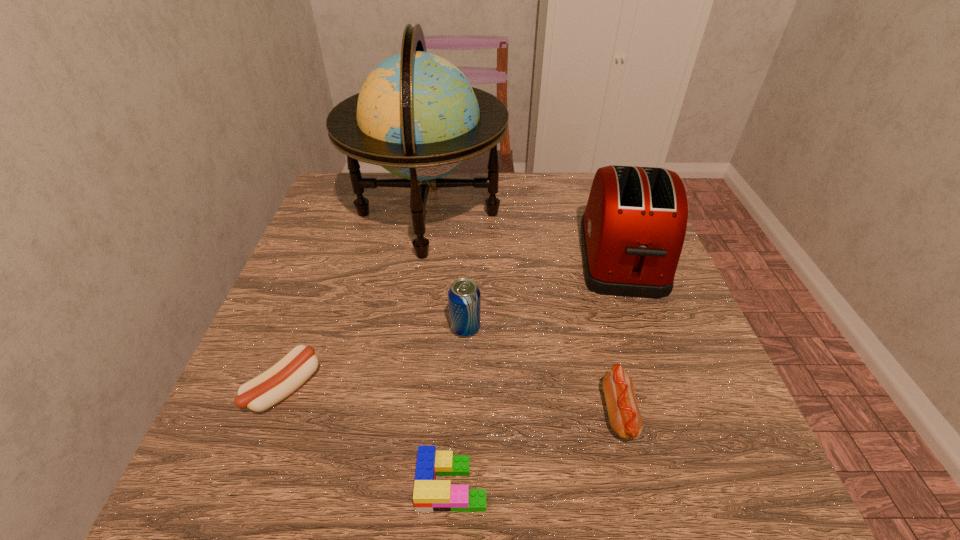
Identify the location of vacant space at the left edge. (349, 245).

The width and height of the screenshot is (960, 540). I want to click on free space at the right edge of the desktop, so click(685, 323).

What are the coordinates of `vacant space at the far left corner` in the screenshot? It's located at (337, 172).

The image size is (960, 540). In the image, there is a desktop. Identify the location of vacant space at the near left corner. (280, 455).

This screenshot has height=540, width=960. In the image, there is a desktop. Identify the location of free space at the far right corner. (587, 201).

The image size is (960, 540). I want to click on blank space at the near right corner of the desktop, so click(676, 475).

I want to click on free space between the right sausage and the fourth shortest object, so click(x=542, y=370).

Locate an element on the screen. Image resolution: width=960 pixels, height=540 pixels. free space that is in between the left sausage and the right sausage is located at coordinates (452, 400).

Locate an element on the screen. free spot between the left sausage and the nearest object is located at coordinates (369, 436).

The width and height of the screenshot is (960, 540). Identify the location of vacant area between the toaster and the right sausage. [621, 336].